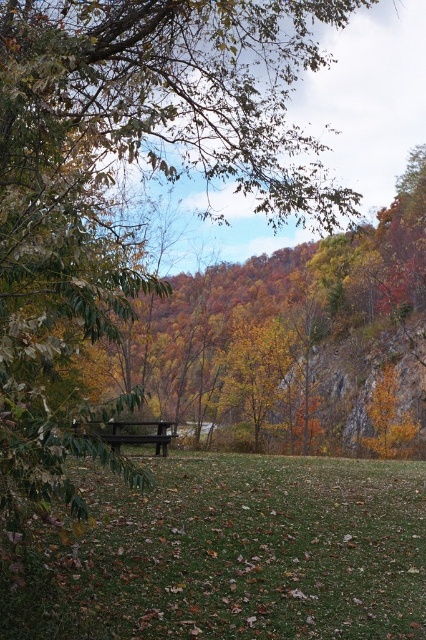
Question: In this image, where is green grassy field at center located relative to wooden bench at center?

Choices:
 (A) below
 (B) above

Answer: (A)

Question: Is green grassy field at center behind wooden bench at center?

Choices:
 (A) no
 (B) yes

Answer: (B)

Question: Can you confirm if green grassy field at center is wider than wooden bench at center?

Choices:
 (A) yes
 (B) no

Answer: (A)

Question: Which of the following is the closest to the observer?

Choices:
 (A) (249, 593)
 (B) (126, 444)

Answer: (A)